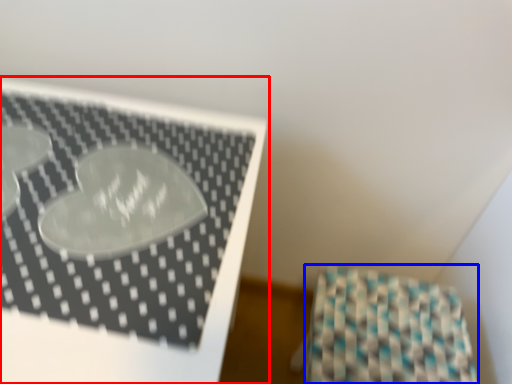
Question: Which object is closer to the camera taking this photo, furniture (highlighted by a red box) or wrapping paper (highlighted by a blue box)?

Choices:
 (A) furniture
 (B) wrapping paper

Answer: (A)